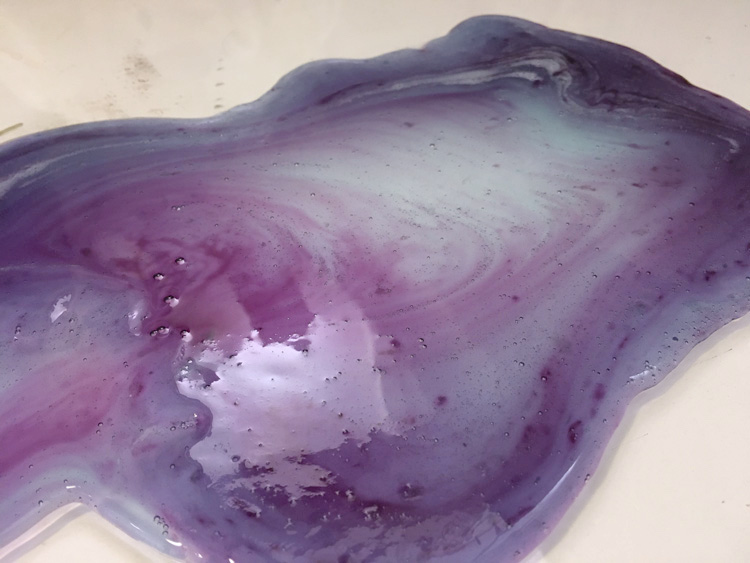
Find the location of `light glare/ reflection`. light glare/ reflection is located at coordinates (303, 428).